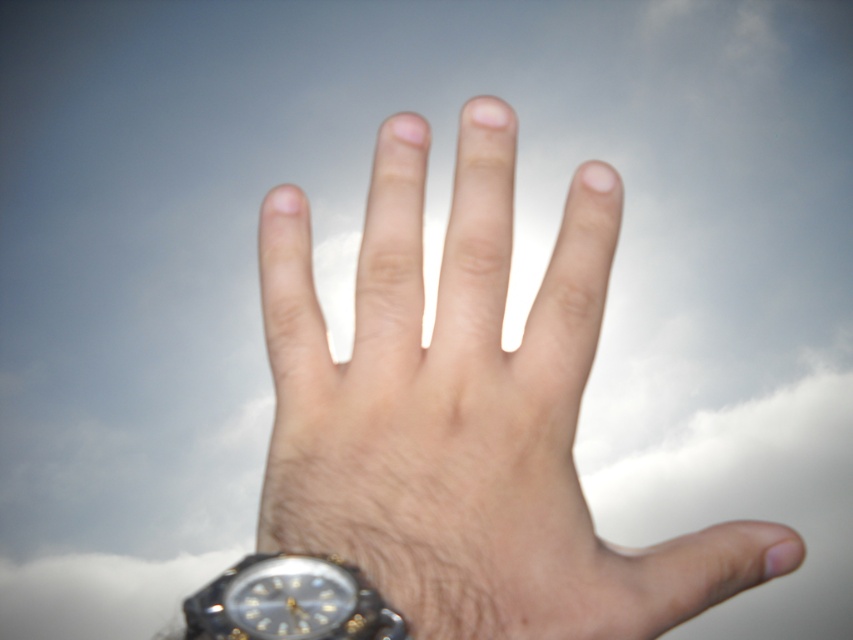
Question: Considering the relative positions of smooth skin hand at center and black plastic watch at lower left in the image provided, where is smooth skin hand at center located with respect to black plastic watch at lower left?

Choices:
 (A) below
 (B) above

Answer: (B)

Question: Among these points, which one is nearest to the camera?

Choices:
 (A) (375, 499)
 (B) (390, 608)

Answer: (B)

Question: Which of the following is the closest to the observer?

Choices:
 (A) (312, 577)
 (B) (383, 285)

Answer: (A)

Question: Does smooth skin hand at center appear on the right side of black plastic watch at lower left?

Choices:
 (A) no
 (B) yes

Answer: (B)

Question: Which of the following is the farthest from the observer?

Choices:
 (A) (404, 241)
 (B) (325, 566)

Answer: (A)

Question: Is smooth skin hand at center smaller than black plastic watch at lower left?

Choices:
 (A) yes
 (B) no

Answer: (B)